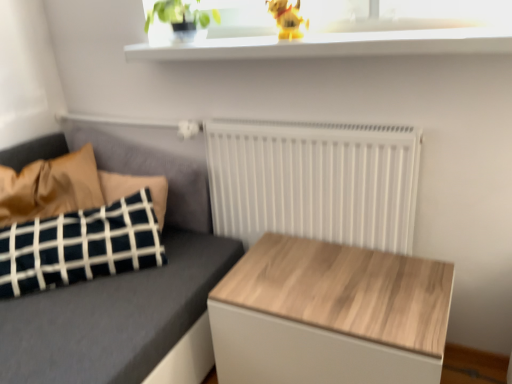
This screenshot has width=512, height=384. What are the coordinates of `vacant area to the left of yellow plastic dog at upper center` in the screenshot? It's located at (243, 40).